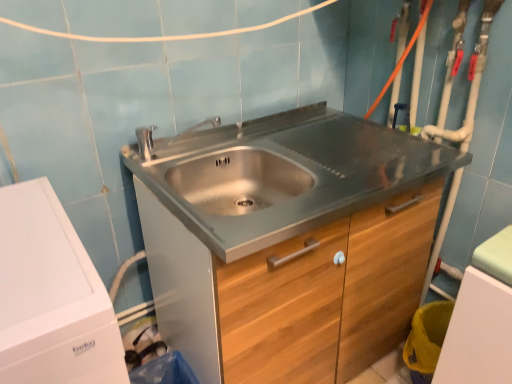
Question: Considering the positions of white matte washing machine at left and stainless steel cabinet at center in the image, is white matte washing machine at left taller or shorter than stainless steel cabinet at center?

Choices:
 (A) short
 (B) tall

Answer: (B)

Question: Is point (44, 251) closer or farther from the camera than point (155, 208)?

Choices:
 (A) closer
 (B) farther

Answer: (A)

Question: Choose the correct answer: Is white matte washing machine at left inside stainless steel cabinet at center or outside it?

Choices:
 (A) inside
 (B) outside

Answer: (B)

Question: Looking at the image, does stainless steel cabinet at center seem bigger or smaller compared to white matte washing machine at left?

Choices:
 (A) small
 (B) big

Answer: (B)

Question: Looking at their shapes, would you say stainless steel cabinet at center is wider or thinner than white matte washing machine at left?

Choices:
 (A) thin
 (B) wide

Answer: (A)

Question: Is point (303, 269) positioned closer to the camera than point (16, 269)?

Choices:
 (A) farther
 (B) closer

Answer: (A)

Question: Relative to white matte washing machine at left, is stainless steel cabinet at center in front or behind?

Choices:
 (A) front
 (B) behind

Answer: (B)